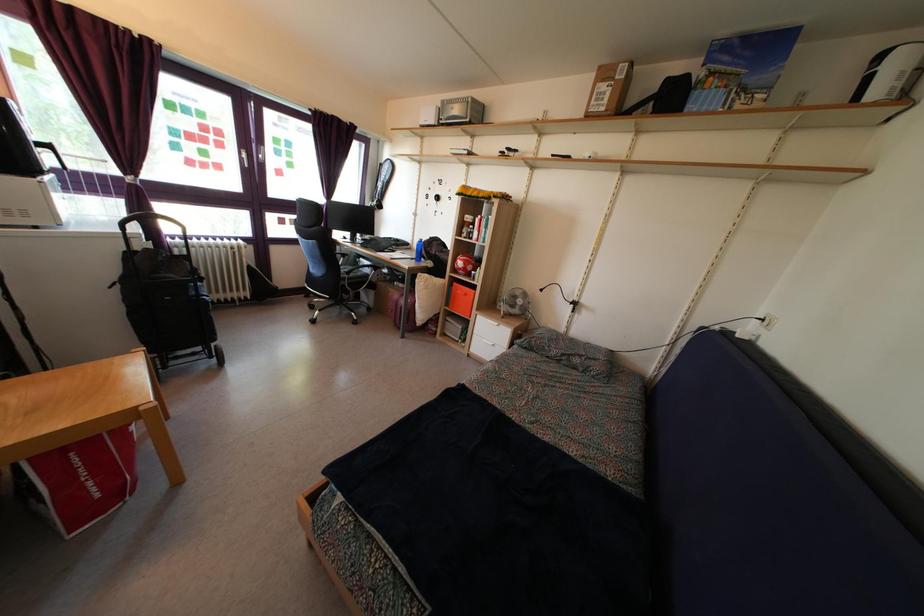
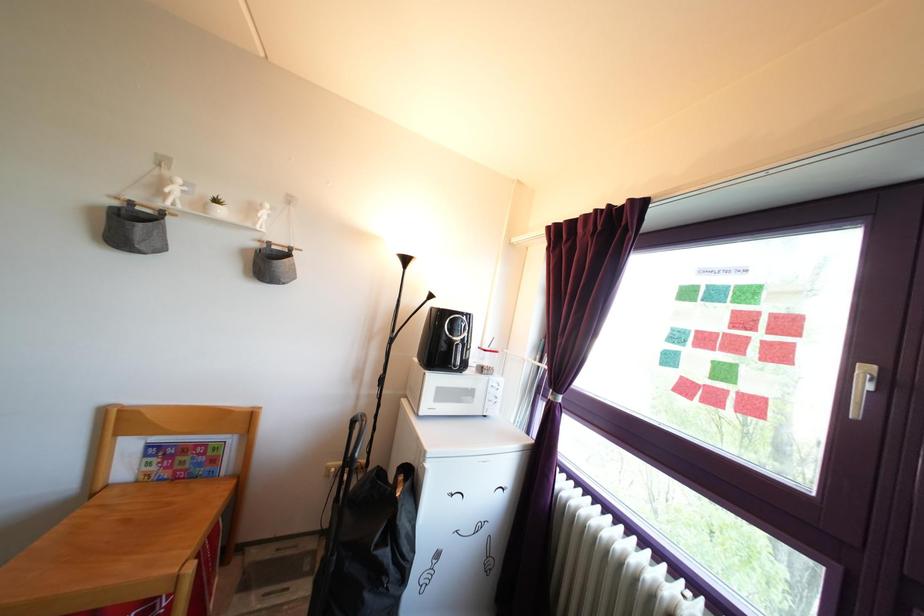
Find the pixel in the second image that matches pixel 214 146 in the first image.

(761, 345)